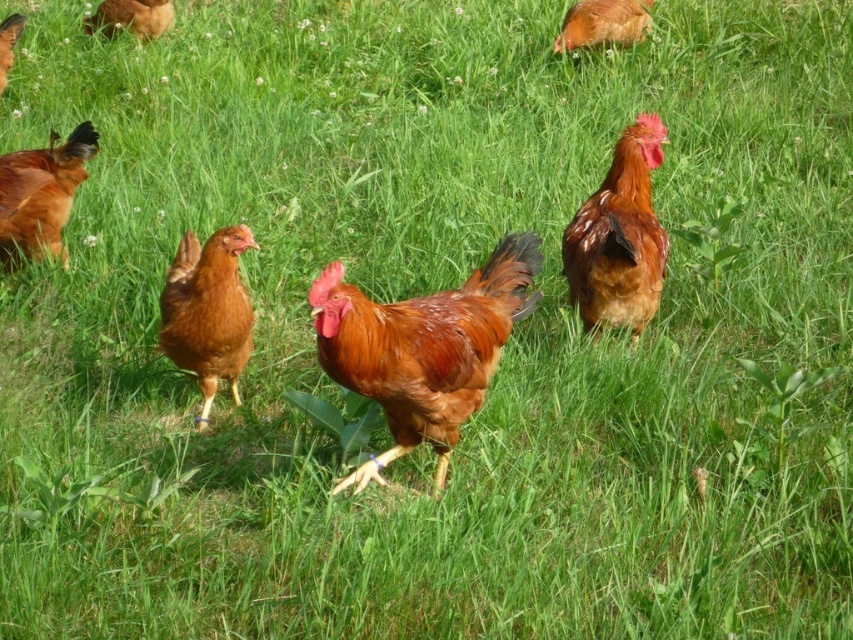
Locate an element on the screen. The image size is (853, 640). matte brown chicken at left is located at coordinates (41, 193).

The width and height of the screenshot is (853, 640). Identify the location of matte brown chicken at left. (41, 193).

Is matte brown chicken at center positioned behind matte brown chicken at left?

No, matte brown chicken at center is in front of matte brown chicken at left.

Is point (231, 333) positioned after point (10, 157)?

No, (231, 333) is in front of (10, 157).

Which is in front, point (257, 244) or point (48, 241)?

Point (257, 244)

You are a GUI agent. You are given a task and a screenshot of the screen. Output one action in this format:
    pyautogui.click(x=<x>, y=<y>)
    Task: Click on the matte brown chicken at center
    This screenshot has width=853, height=640.
    Given the screenshot: What is the action you would take?
    pyautogui.click(x=207, y=310)

Consider the image. Between matte brown chicken at center and matte brown chicken at upper left, which one appears on the left side from the viewer's perspective?

matte brown chicken at upper left is more to the left.

Is matte brown chicken at center bigger than matte brown chicken at upper left?

Yes.

Is point (177, 266) farther from viewer compared to point (7, 36)?

That is False.

Locate an element on the screen. matte brown chicken at center is located at coordinates (207, 310).